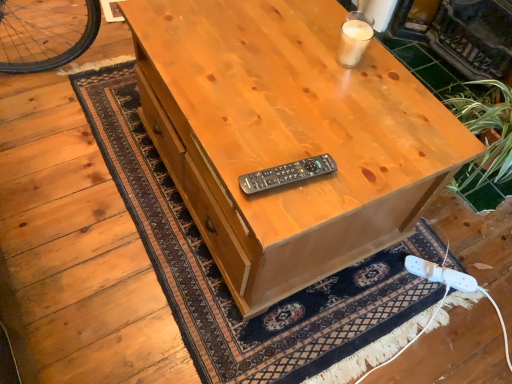
This screenshot has height=384, width=512. Find the location of `vacant space behind white plastic game controller at lower right`. vacant space behind white plastic game controller at lower right is located at coordinates pyautogui.click(x=434, y=250).